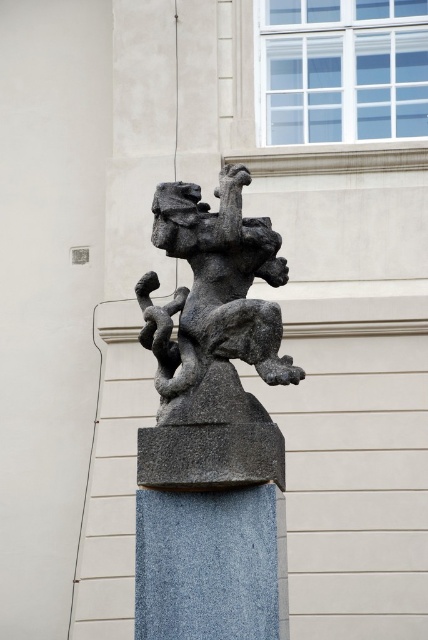
You are standing in front of the sculpture and want to take a photo of both the granite statue at center and the gray stone pillar at center. Which object should you position to your left side to include both in the frame?

You should position the gray stone pillar at center to your left side because the granite statue at center is to the left of the gray stone pillar at center, so placing the pillar on your left would place the statue further left in the frame, allowing both to be captured.

You are an art conservator assessing the placement of the granite statue at center and the gray stone pillar at center in the image. Based on their positions, which object is closer to the viewer?

The granite statue at center is closer to the viewer because the gray stone pillar at center is positioned behind it.